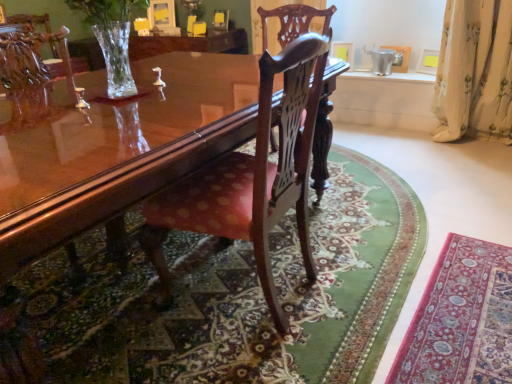
Find the location of a particular element. free point above velvet red rug at lower right (from a real-world perspective) is located at coordinates tap(456, 331).